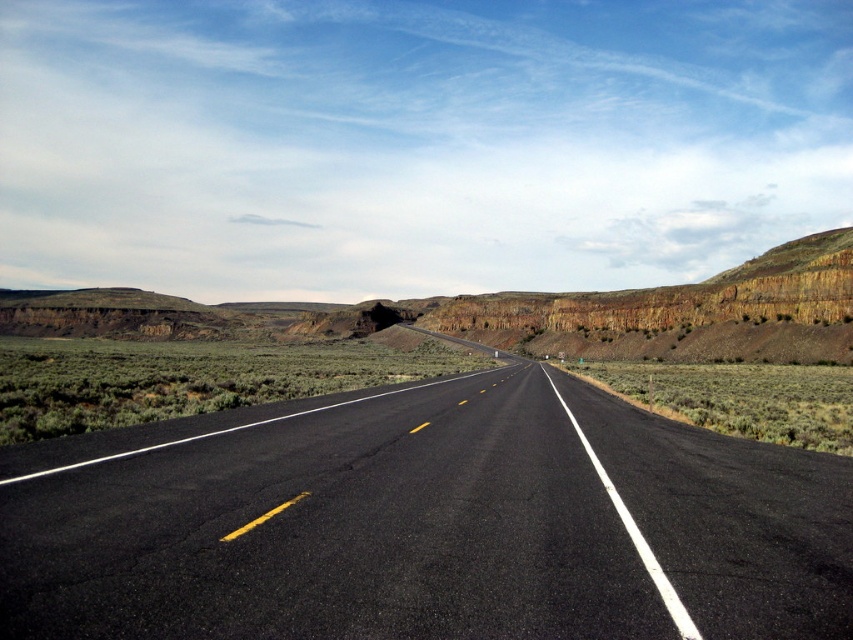
You are a driver approaching a long, straight two lane road with a double yellow line in the center. You see a point marked at coordinates [425,522]. Where is this point located?

The point is located on the black asphalt highway at center.

You are a driver approaching the black asphalt highway at center and the rustic rock formation at center. Which one appears narrower from your perspective?

The black asphalt highway at center appears narrower because it has a lesser width compared to the rustic rock formation at center.

You are a driver approaching the road in the image. You see two points marked on the road ahead. Which point is closer to you, point [757,600] or point [169,308]?

Point [757,600] is closer to the viewer than point [169,308].